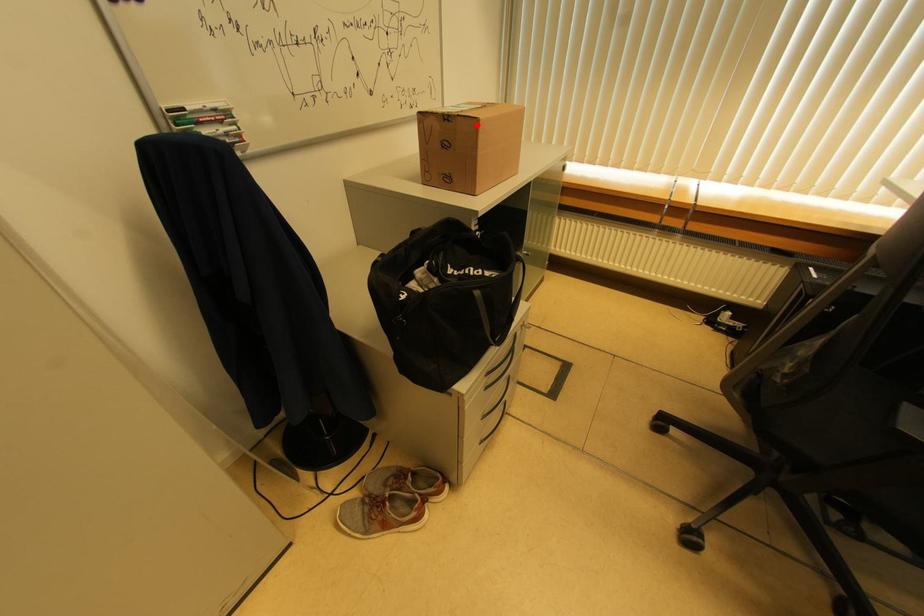
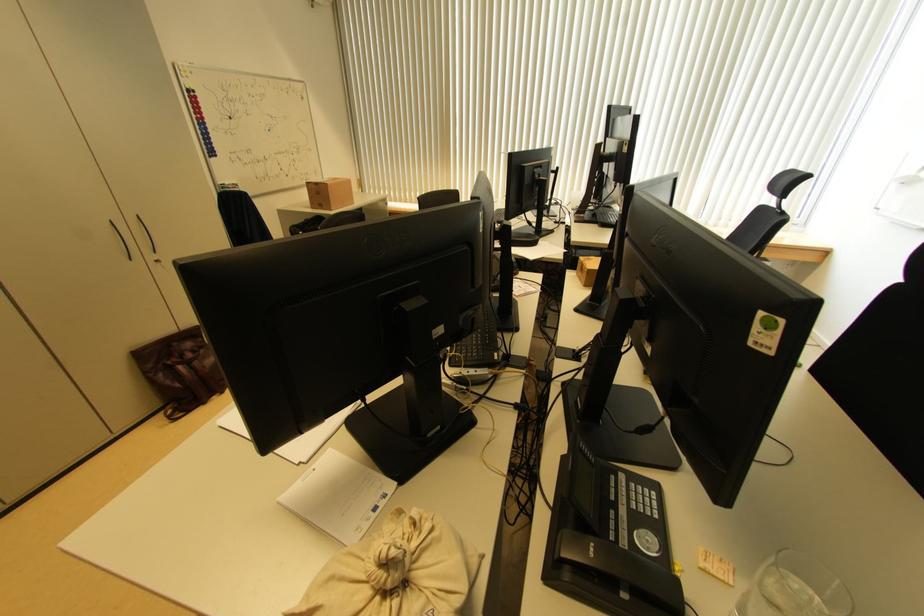
Locate, in the second image, the point that corresponds to the highlighted location in the first image.

(329, 188)